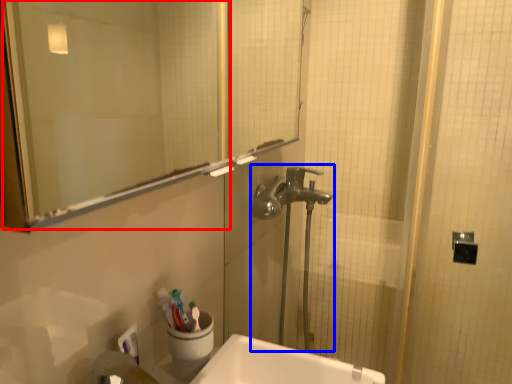
Question: Which object is further to the camera taking this photo, mirror (highlighted by a red box) or plumbing fixture (highlighted by a blue box)?

Choices:
 (A) mirror
 (B) plumbing fixture

Answer: (B)